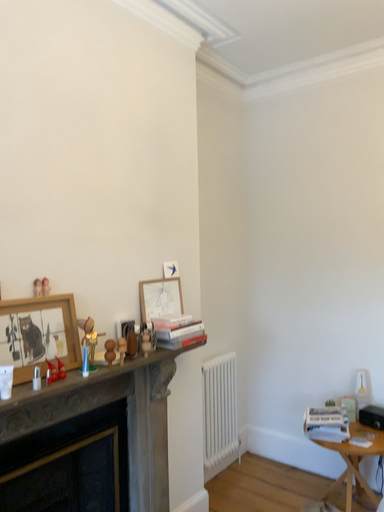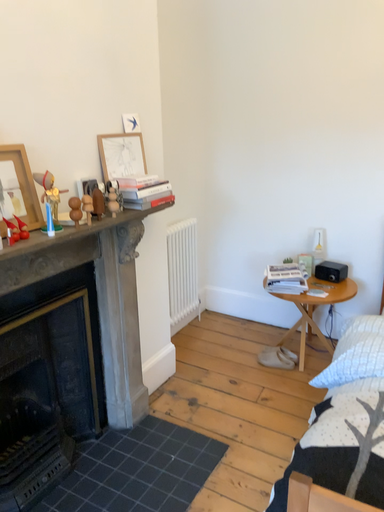
Question: How did the camera likely rotate when shooting the video?

Choices:
 (A) rotated upward
 (B) rotated downward

Answer: (B)